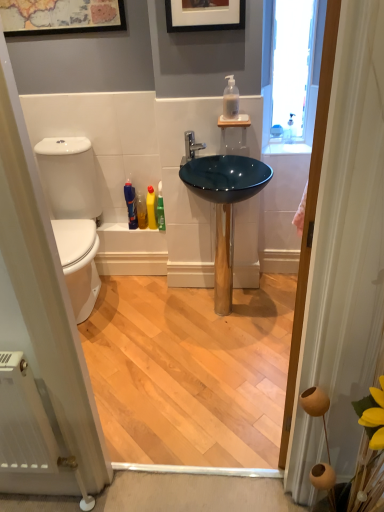
Question: Does yellow plastic bottle at lower center, which is the 2th toiletry from right to left, come in front of polished chrome faucet at center?

Choices:
 (A) no
 (B) yes

Answer: (A)

Question: Is yellow plastic bottle at lower center, the 3th toiletry positioned from the left, next to polished chrome faucet at center?

Choices:
 (A) yes
 (B) no

Answer: (B)

Question: Considering the relative sizes of yellow plastic bottle at lower center, the 3th toiletry positioned from the left, and polished chrome faucet at center in the image provided, is yellow plastic bottle at lower center, the 3th toiletry positioned from the left, wider than polished chrome faucet at center?

Choices:
 (A) no
 (B) yes

Answer: (A)

Question: Does yellow plastic bottle at lower center, which is the 2th toiletry from right to left, have a lesser width compared to polished chrome faucet at center?

Choices:
 (A) yes
 (B) no

Answer: (A)

Question: Is yellow plastic bottle at lower center, the 3th toiletry positioned from the left, not inside polished chrome faucet at center?

Choices:
 (A) yes
 (B) no

Answer: (A)

Question: Is point (69, 202) positioned closer to the camera than point (137, 199)?

Choices:
 (A) farther
 (B) closer

Answer: (B)

Question: Considering the positions of white glossy toilet at left and translucent plastic bottle at lower left, placed as the third toiletry when sorted from right to left, in the image, is white glossy toilet at left taller or shorter than translucent plastic bottle at lower left, placed as the third toiletry when sorted from right to left,?

Choices:
 (A) short
 (B) tall

Answer: (B)

Question: In the image, is white glossy toilet at left on the left side or the right side of translucent plastic bottle at lower left, arranged as the second toiletry when viewed from the left?

Choices:
 (A) left
 (B) right

Answer: (A)

Question: From a real-world perspective, relative to translucent plastic bottle at lower left, placed as the third toiletry when sorted from right to left, is white glossy toilet at left vertically above or below?

Choices:
 (A) above
 (B) below

Answer: (B)

Question: Based on their sizes in the image, would you say green glossy bottle at center, the 1th toiletry from the right, is bigger or smaller than teal glossy sink at center?

Choices:
 (A) small
 (B) big

Answer: (A)

Question: Is point (162, 202) closer or farther from the camera than point (208, 179)?

Choices:
 (A) closer
 (B) farther

Answer: (B)

Question: In terms of width, does green glossy bottle at center, which is the 4th toiletry from left to right, look wider or thinner when compared to teal glossy sink at center?

Choices:
 (A) wide
 (B) thin

Answer: (B)

Question: Is green glossy bottle at center, which is the 4th toiletry from left to right, taller or shorter than teal glossy sink at center?

Choices:
 (A) short
 (B) tall

Answer: (A)

Question: Do you think translucent glass soap dispenser at upper right is within translucent plastic bottles at lower center, placed as the 4th toiletry when sorted from right to left, or outside of it?

Choices:
 (A) outside
 (B) inside

Answer: (A)

Question: Considering the positions of point (281, 153) and point (132, 199), is point (281, 153) closer or farther from the camera than point (132, 199)?

Choices:
 (A) farther
 (B) closer

Answer: (B)